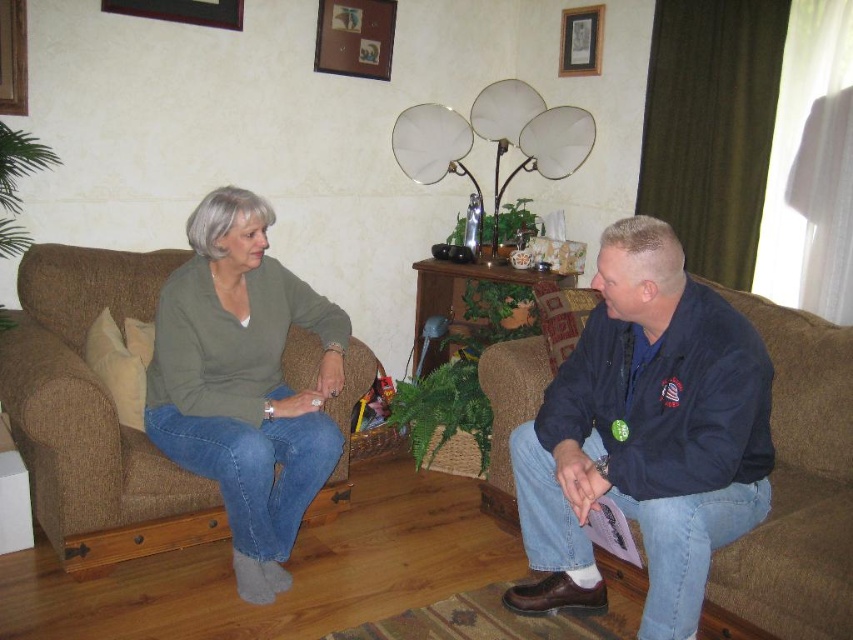
Is dark blue fabric jacket at right further to the viewer compared to brown fabric couch at left?

No, it is not.

Between dark blue fabric jacket at right and brown fabric couch at left, which one appears on the right side from the viewer's perspective?

dark blue fabric jacket at right

Between point (560, 385) and point (61, 284), which one is positioned behind?

Point (61, 284)

This screenshot has width=853, height=640. I want to click on dark blue fabric jacket at right, so (x=645, y=435).

Does point (701, 436) lie behind point (225, 412)?

No.

Is point (193, 403) more distant than point (254, 531)?

That is True.

Where is `denim jeans at center`? The image size is (853, 640). denim jeans at center is located at coordinates (647, 436).

Who is more distant from viewer, (572, 376) or (77, 554)?

The point (77, 554) is behind.

Can you confirm if denim jeans at center is positioned below brown fabric couch at left?

Correct, denim jeans at center is located below brown fabric couch at left.

Is point (583, 392) less distant than point (86, 268)?

Yes, point (583, 392) is in front of point (86, 268).

Find the location of a particular element. The width and height of the screenshot is (853, 640). denim jeans at center is located at coordinates (647, 436).